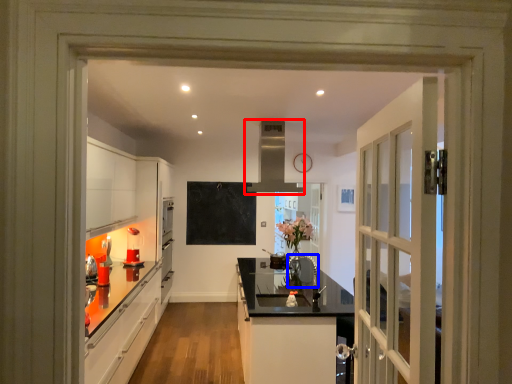
Question: Which object is further to the camera taking this photo, exhaust hood (highlighted by a red box) or appliance (highlighted by a blue box)?

Choices:
 (A) exhaust hood
 (B) appliance

Answer: (A)